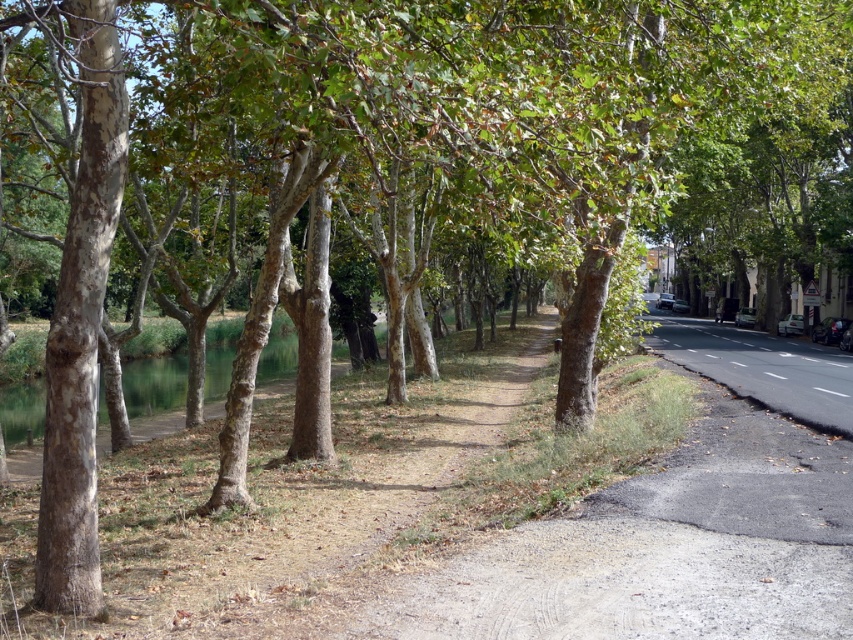
Which is more to the right, dirt/gravel path at center or black asphalt road at right?

Positioned to the right is black asphalt road at right.

Is dirt/gravel path at center further to the viewer compared to black asphalt road at right?

No.

Who is more forward, (682, 582) or (717, 358)?

Point (682, 582) is more forward.

The image size is (853, 640). Identify the location of dirt/gravel path at center. (664, 548).

Does dirt/gravel path at center appear on the right side of white asphalt line at road center?

No, dirt/gravel path at center is not to the right of white asphalt line at road center.

Image resolution: width=853 pixels, height=640 pixels. What do you see at coordinates (664, 548) in the screenshot?
I see `dirt/gravel path at center` at bounding box center [664, 548].

Which is behind, point (412, 628) or point (822, 387)?

The point (822, 387) is more distant.

The image size is (853, 640). I want to click on dirt/gravel path at center, so click(664, 548).

Find the location of a particular element. The height and width of the screenshot is (640, 853). black asphalt road at right is located at coordinates (762, 368).

Who is lower down, black asphalt road at right or white asphalt line at road center?

white asphalt line at road center is below.

Who is more distant from viewer, (x=815, y=348) or (x=846, y=394)?

The point (x=815, y=348) is more distant.

Find the location of a particular element. The image size is (853, 640). black asphalt road at right is located at coordinates (762, 368).